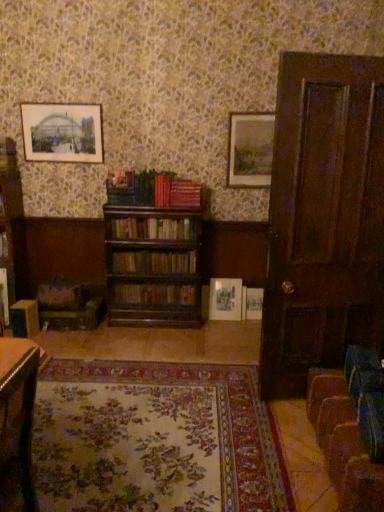
The width and height of the screenshot is (384, 512). I want to click on empty space that is ontop of matte wooden picture frame at upper right, the third picture frame when ordered from bottom to top (from a real-world perspective), so click(254, 108).